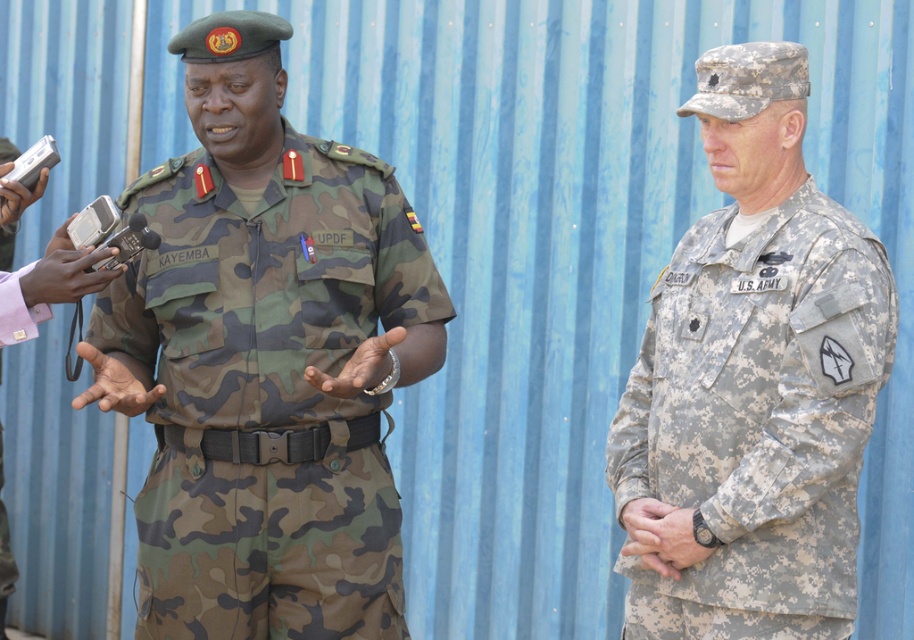
Question: Which of the following is the closest to the observer?

Choices:
 (A) camouflage fabric us army uniform at right
 (B) camo fabric uniform at center

Answer: (B)

Question: In this image, where is camo fabric uniform at center located relative to camouflage fabric us army uniform at right?

Choices:
 (A) left
 (B) right

Answer: (A)

Question: Does camo fabric uniform at center have a larger size compared to camouflage fabric us army uniform at right?

Choices:
 (A) yes
 (B) no

Answer: (A)

Question: Which point is farther to the camera?

Choices:
 (A) camouflage fabric us army uniform at right
 (B) camo fabric uniform at center

Answer: (A)

Question: Is camo fabric uniform at center positioned in front of camouflage fabric us army uniform at right?

Choices:
 (A) no
 (B) yes

Answer: (B)

Question: Which of the following is the closest to the observer?

Choices:
 (A) camo fabric uniform at center
 (B) camouflage fabric us army uniform at right

Answer: (A)